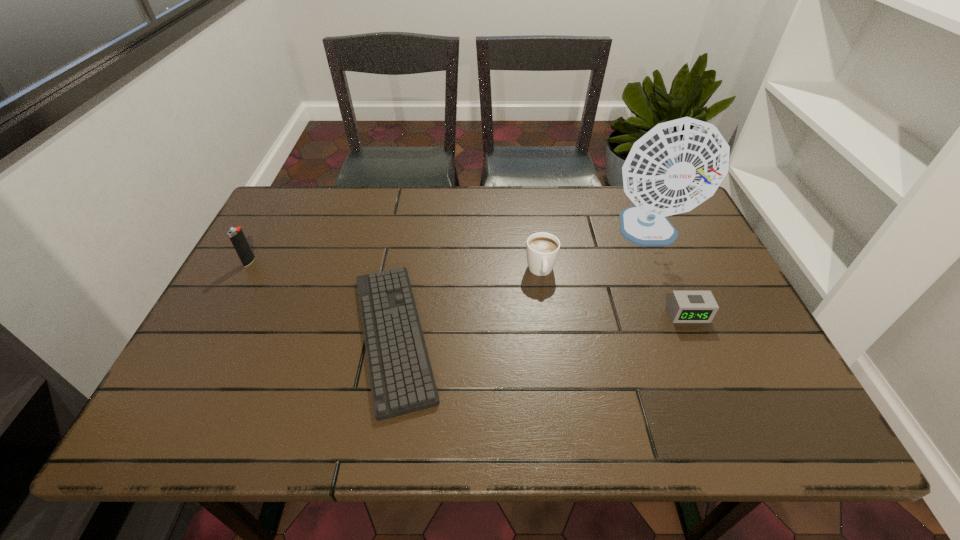
Where is `free space located with the handle on the side of the third shortest object`? The image size is (960, 540). free space located with the handle on the side of the third shortest object is located at coordinates (558, 393).

Locate an element on the screen. Image resolution: width=960 pixels, height=540 pixels. vacant space located 0.210m on the front-facing side of the fourth tallest object is located at coordinates (727, 403).

At what (x,y) coordinates should I click in order to perform the action: click on free space located 0.090m on the back of the shortest object. Please return your answer as a coordinate pair (x, y). The image size is (960, 540). Looking at the image, I should click on (409, 249).

I want to click on object present at the far edge, so (677, 165).

At what (x,y) coordinates should I click in order to perform the action: click on object located at the near edge. Please return your answer as a coordinate pair (x, y). The width and height of the screenshot is (960, 540). Looking at the image, I should click on (401, 378).

Locate an element on the screen. This screenshot has height=540, width=960. object located in the left edge section of the desktop is located at coordinates (236, 235).

Identify the location of fan that is at the right edge. (677, 165).

Identify the location of alarm clock at the right edge. This screenshot has width=960, height=540. (683, 306).

Where is `object at the far right corner`? The height and width of the screenshot is (540, 960). object at the far right corner is located at coordinates (677, 165).

At what (x,y) coordinates should I click in order to perform the action: click on vacant space at the far edge of the desktop. Please return your answer as a coordinate pair (x, y). The width and height of the screenshot is (960, 540). Looking at the image, I should click on (609, 195).